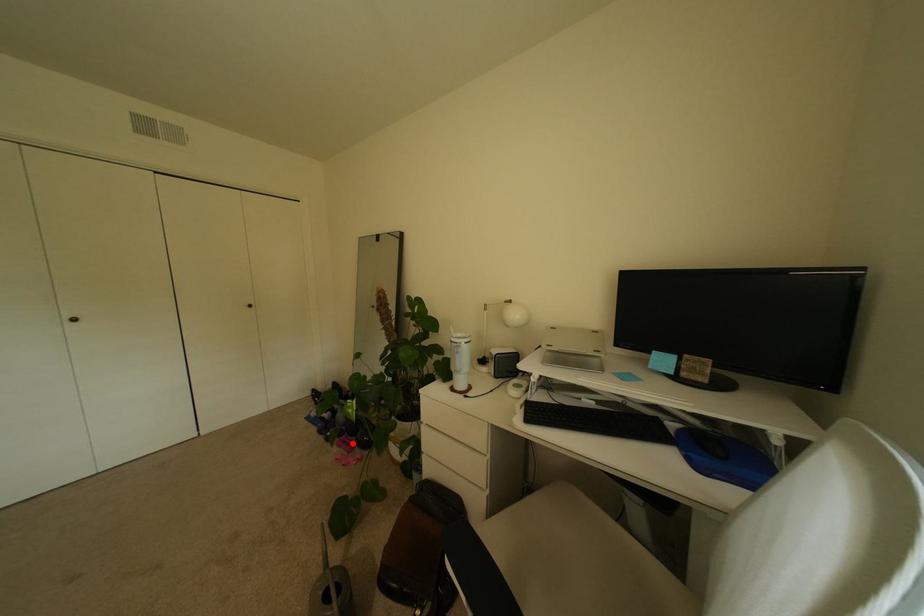
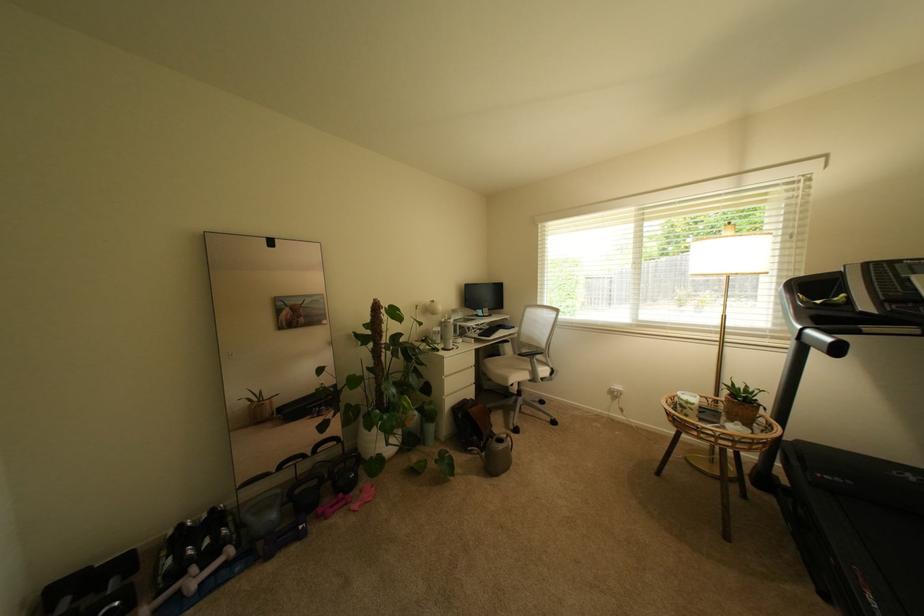
Question: I am providing you with two images of the same scene from different viewpoints. Image1 has a red point marked. In image2, the corresponding 3D location appears at what relative position? Reply with the corresponding letter.

Choices:
 (A) Closer
 (B) Farther

Answer: (A)